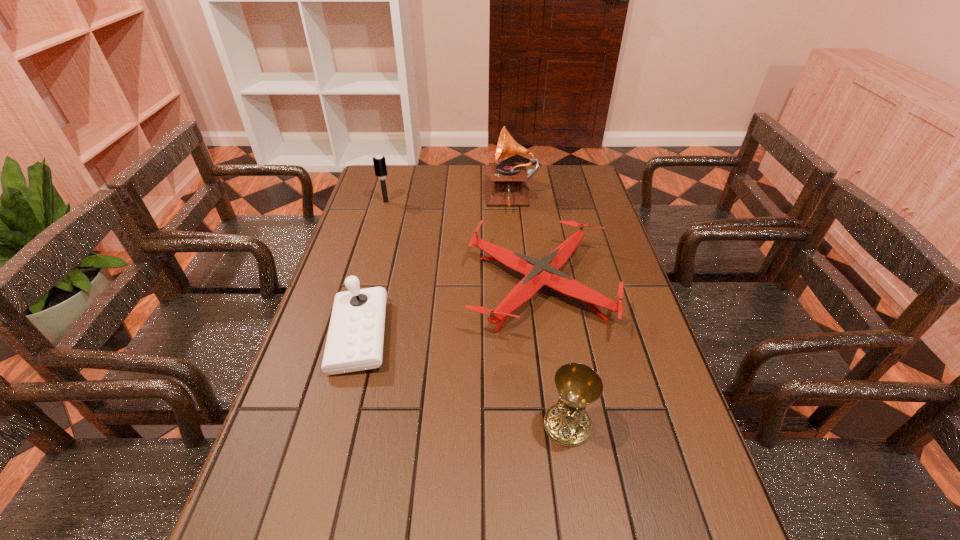
Identify the location of blank space located on the back of the joystick. (382, 249).

I want to click on vacant space located on the left of the drone, so click(x=376, y=287).

Identify the location of object present at the far edge. This screenshot has width=960, height=540. (507, 187).

Locate an element on the screen. The image size is (960, 540). hairbrush that is at the left edge is located at coordinates (379, 162).

Where is `joystick that is at the left edge`? joystick that is at the left edge is located at coordinates (355, 337).

Identify the location of object at the right edge. This screenshot has width=960, height=540. (538, 273).

In the image, there is a desktop. Where is `free space at the far edge`? This screenshot has width=960, height=540. free space at the far edge is located at coordinates (540, 196).

The width and height of the screenshot is (960, 540). Identify the location of vacant region at the left edge of the desktop. [324, 518].

In the image, there is a desktop. Where is `free space at the right edge`? The width and height of the screenshot is (960, 540). free space at the right edge is located at coordinates (587, 251).

This screenshot has width=960, height=540. What are the coordinates of `free space at the far left corner` in the screenshot? It's located at (380, 190).